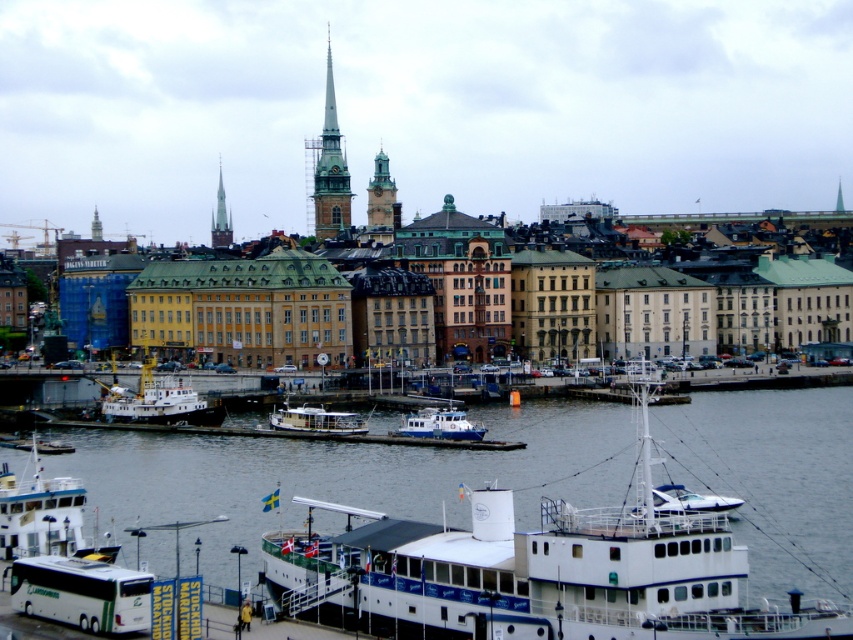
Question: Which point is farther to the camera?

Choices:
 (A) (339, 211)
 (B) (303, 428)
 (C) (374, 188)

Answer: (A)

Question: Among these points, which one is farthest from the camera?

Choices:
 (A) (445, 408)
 (B) (225, 205)
 (C) (531, 568)
 (D) (112, 596)

Answer: (B)

Question: Does white matte bus at lower left appear under white plastic boat at center?

Choices:
 (A) no
 (B) yes

Answer: (B)

Question: Can you confirm if white matte tugboat at lower left is bigger than white glossy speedboat at lower right?

Choices:
 (A) no
 (B) yes

Answer: (B)

Question: Does smooth stone spire at center appear on the left side of wooden polished boat at center?

Choices:
 (A) no
 (B) yes

Answer: (B)

Question: Considering the real-world distances, which object is closest to the white glossy boat at lower center?

Choices:
 (A) white glossy speedboat at lower right
 (B) white matte bus at lower left
 (C) white plastic boat at center

Answer: (A)